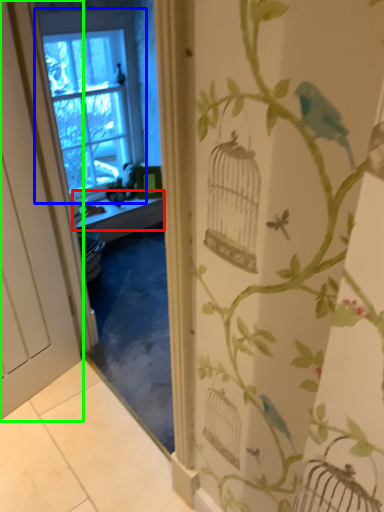
Question: Which object is the closest to the window sill (highlighted by a red box)? Choose among these: window (highlighted by a blue box) or door (highlighted by a green box).

Choices:
 (A) window
 (B) door

Answer: (A)